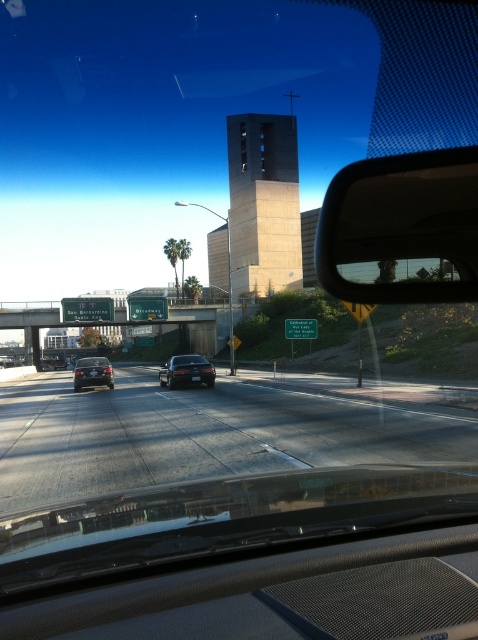
Question: Estimate the real-world distances between objects in this image. Which object is farther from the matte black mirror at upper right?

Choices:
 (A) shiny silver sedan at center
 (B) green sign at upper center
 (C) smooth asphalt highway at center

Answer: (B)

Question: Is green sign at upper center thinner than satin black sedan at center?

Choices:
 (A) no
 (B) yes

Answer: (A)

Question: From the image, what is the correct spatial relationship of matte black mirror at upper right in relation to green sign at upper center?

Choices:
 (A) above
 (B) below

Answer: (A)

Question: Does smooth asphalt highway at center have a greater width compared to matte black mirror at upper right?

Choices:
 (A) no
 (B) yes

Answer: (B)

Question: Which of the following is the closest to the observer?

Choices:
 (A) (415, 465)
 (B) (85, 364)
 (C) (42, 312)

Answer: (A)

Question: Which object is positioned farthest from the green sign at upper center?

Choices:
 (A) satin black sedan at center
 (B) smooth asphalt highway at center
 (C) matte black mirror at upper right

Answer: (C)